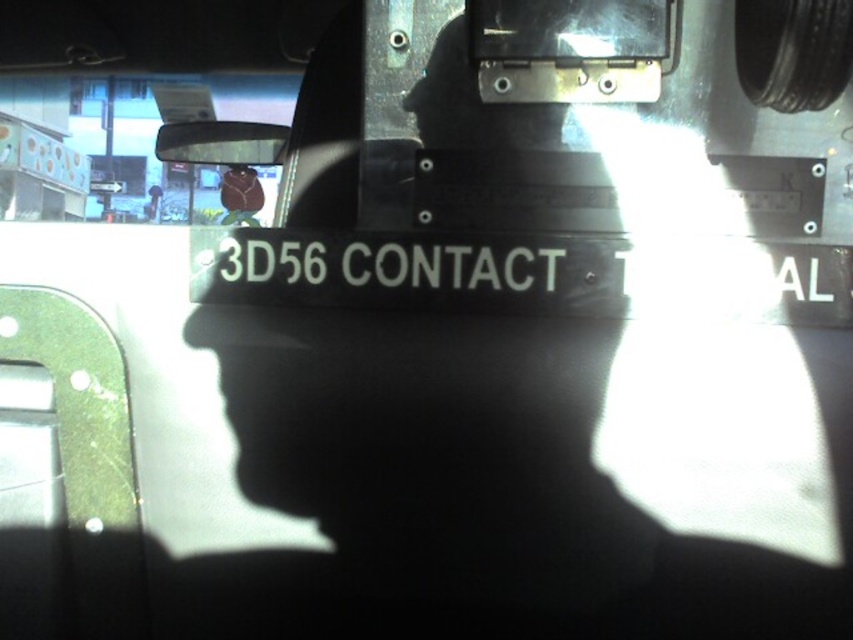
You are a passenger in the car and want to read the text on the white plastic sign at center and the clear plastic view mirror at upper left. Which object is closer to you?

The white plastic sign at center is closer to you because it is positioned below the clear plastic view mirror at upper left, meaning it is lower and thus nearer in the field of view.

You are a delivery driver who needs to attach a GPS tracker to your vehicle. The GPS tracker is 3 inches wide. You see the white plastic sign at center and the clear plastic view mirror at upper left. Can you fit the GPS tracker between them?

The white plastic sign at center and the clear plastic view mirror at upper left are 28.06 inches apart from each other. Since the GPS tracker is only 3 inches wide, there is enough space between them to fit the GPS tracker.

You are sitting in the driver seat of the vehicle and want to adjust the clear plastic view mirror at upper left. To do this, you need to first look away from the white plastic sign at center. Which object is closer to your eyes so you can reach it first?

The white plastic sign at center is closer to the viewer than the clear plastic view mirror at upper left, so you can reach it first.